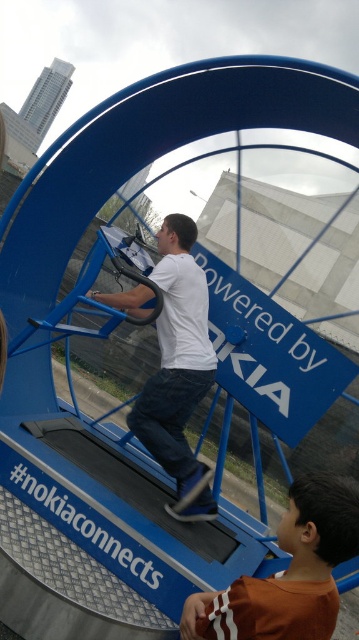
Question: Does brown cotton shirt at lower right appear on the right side of white matte shirt at center?

Choices:
 (A) no
 (B) yes

Answer: (B)

Question: Is brown cotton shirt at lower right thinner than white matte shirt at center?

Choices:
 (A) yes
 (B) no

Answer: (A)

Question: Is brown cotton shirt at lower right below white matte shirt at center?

Choices:
 (A) yes
 (B) no

Answer: (A)

Question: Which point is closer to the camera?

Choices:
 (A) white matte shirt at center
 (B) brown cotton shirt at lower right

Answer: (B)